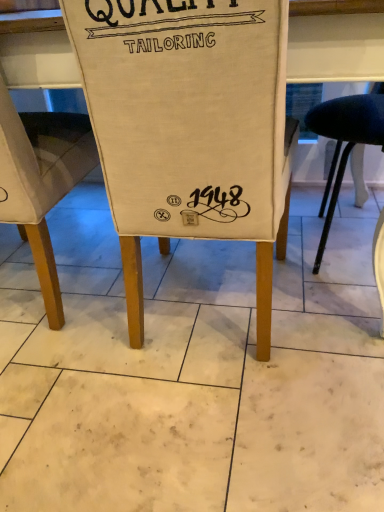
Describe the element at coordinates (190, 128) in the screenshot. I see `canvas bag at center, positioned as the 1th chair in right-to-left order` at that location.

The height and width of the screenshot is (512, 384). What are the coordinates of `canvas bag at center, positioned as the 1th chair in right-to-left order` in the screenshot? It's located at (190, 128).

The width and height of the screenshot is (384, 512). In order to click on canvas chair at lower left, acting as the 1th chair starting from the left in this screenshot , I will do `click(41, 181)`.

Measure the distance between point (29, 190) and camera.

A distance of 1.04 meters exists between point (29, 190) and camera.

The height and width of the screenshot is (512, 384). Describe the element at coordinates (41, 181) in the screenshot. I see `canvas chair at lower left, the 2th chair viewed from the right` at that location.

I want to click on canvas bag at center, positioned as the 1th chair in right-to-left order, so click(190, 128).

Is canvas chair at lower left, the 2th chair viewed from the right, to the left or to the right of canvas bag at center, positioned as the 1th chair in right-to-left order, in the image?

From the image, it's evident that canvas chair at lower left, the 2th chair viewed from the right, is to the left of canvas bag at center, positioned as the 1th chair in right-to-left order.

Looking at this image, is canvas chair at lower left, the 2th chair viewed from the right, further to camera compared to canvas bag at center, which appears as the second chair when viewed from the left?

Yes.

Which is further, (27,123) or (154,106)?

The point (27,123) is behind.

From the image's perspective, is canvas chair at lower left, the 2th chair viewed from the right, located above or below canvas bag at center, which appears as the second chair when viewed from the left?

Based on their image positions, canvas chair at lower left, the 2th chair viewed from the right, is located above canvas bag at center, which appears as the second chair when viewed from the left.

From a real-world perspective, which is physically below, canvas chair at lower left, acting as the 1th chair starting from the left, or canvas bag at center, which appears as the second chair when viewed from the left?

In real-world perspective, canvas chair at lower left, acting as the 1th chair starting from the left, is lower.

In the scene shown: Which of these two, canvas chair at lower left, acting as the 1th chair starting from the left, or canvas bag at center, which appears as the second chair when viewed from the left, is thinner?

canvas chair at lower left, acting as the 1th chair starting from the left, is thinner.

Which of these two, canvas chair at lower left, acting as the 1th chair starting from the left, or canvas bag at center, which appears as the second chair when viewed from the left, stands shorter?

With less height is canvas chair at lower left, acting as the 1th chair starting from the left.

Between canvas chair at lower left, acting as the 1th chair starting from the left, and canvas bag at center, positioned as the 1th chair in right-to-left order, which one has smaller size?

canvas chair at lower left, acting as the 1th chair starting from the left.

Is canvas chair at lower left, the 2th chair viewed from the right, positioned beyond the bounds of canvas bag at center, positioned as the 1th chair in right-to-left order?

Absolutely, canvas chair at lower left, the 2th chair viewed from the right, is external to canvas bag at center, positioned as the 1th chair in right-to-left order.

Are canvas chair at lower left, the 2th chair viewed from the right, and canvas bag at center, positioned as the 1th chair in right-to-left order, located far from each other?

canvas chair at lower left, the 2th chair viewed from the right, is near canvas bag at center, positioned as the 1th chair in right-to-left order, not far away.

Is canvas bag at center, positioned as the 1th chair in right-to-left order, at the back of canvas chair at lower left, acting as the 1th chair starting from the left?

No, canvas chair at lower left, acting as the 1th chair starting from the left,'s orientation is not away from canvas bag at center, positioned as the 1th chair in right-to-left order.

Can you tell me how much canvas chair at lower left, acting as the 1th chair starting from the left, and canvas bag at center, positioned as the 1th chair in right-to-left order, differ in facing direction?

The facing directions of canvas chair at lower left, acting as the 1th chair starting from the left, and canvas bag at center, positioned as the 1th chair in right-to-left order, are 0.000404 degrees apart.

You are a GUI agent. You are given a task and a screenshot of the screen. Output one action in this format:
    pyautogui.click(x=<x>, y=<y>)
    Task: Click on the chair located above the canvas chair at lower left, the 2th chair viewed from the right (from a real-world perspective)
    The image size is (384, 512).
    Given the screenshot: What is the action you would take?
    pyautogui.click(x=190, y=128)

In the image, is canvas bag at center, which appears as the second chair when viewed from the left, on the left side or the right side of canvas chair at lower left, acting as the 1th chair starting from the left?

canvas bag at center, which appears as the second chair when viewed from the left, is positioned on canvas chair at lower left, acting as the 1th chair starting from the left,'s right side.

Is canvas bag at center, positioned as the 1th chair in right-to-left order, further to camera compared to canvas chair at lower left, acting as the 1th chair starting from the left?

No, canvas bag at center, positioned as the 1th chair in right-to-left order, is closer to the viewer.

Is point (279, 79) positioned behind point (4, 176)?

No, (279, 79) is in front of (4, 176).

From the image's perspective, which object appears higher, canvas bag at center, which appears as the second chair when viewed from the left, or canvas chair at lower left, the 2th chair viewed from the right?

canvas chair at lower left, the 2th chair viewed from the right, from the image's perspective.

From a real-world perspective, which object stands above the other?

In real-world perspective, canvas bag at center, positioned as the 1th chair in right-to-left order, is above.

Which object is thinner, canvas bag at center, positioned as the 1th chair in right-to-left order, or canvas chair at lower left, acting as the 1th chair starting from the left?

canvas chair at lower left, acting as the 1th chair starting from the left, is thinner.

Considering the sizes of objects canvas bag at center, positioned as the 1th chair in right-to-left order, and canvas chair at lower left, the 2th chair viewed from the right, in the image provided, who is taller, canvas bag at center, positioned as the 1th chair in right-to-left order, or canvas chair at lower left, the 2th chair viewed from the right,?

With more height is canvas bag at center, positioned as the 1th chair in right-to-left order.

Can you confirm if canvas bag at center, which appears as the second chair when viewed from the left, is smaller than canvas chair at lower left, acting as the 1th chair starting from the left?

No, canvas bag at center, which appears as the second chair when viewed from the left, is not smaller than canvas chair at lower left, acting as the 1th chair starting from the left.

Would you say canvas bag at center, which appears as the second chair when viewed from the left, contains canvas chair at lower left, the 2th chair viewed from the right?

No, canvas chair at lower left, the 2th chair viewed from the right, is located outside of canvas bag at center, which appears as the second chair when viewed from the left.

Can you see canvas bag at center, which appears as the second chair when viewed from the left, touching canvas chair at lower left, the 2th chair viewed from the right?

canvas bag at center, which appears as the second chair when viewed from the left, and canvas chair at lower left, the 2th chair viewed from the right, are not in contact.

Is canvas bag at center, which appears as the second chair when viewed from the left, aimed at canvas chair at lower left, acting as the 1th chair starting from the left?

No, canvas bag at center, which appears as the second chair when viewed from the left, is not aimed at canvas chair at lower left, acting as the 1th chair starting from the left.

How much distance is there between canvas bag at center, which appears as the second chair when viewed from the left, and canvas chair at lower left, acting as the 1th chair starting from the left?

They are 14.96 inches apart.

You are a GUI agent. You are given a task and a screenshot of the screen. Output one action in this format:
    pyautogui.click(x=<x>, y=<y>)
    Task: Click on the chair that is behind the canvas bag at center, positioned as the 1th chair in right-to-left order
    This screenshot has width=384, height=512.
    Given the screenshot: What is the action you would take?
    click(41, 181)

Find the location of a particular element. This screenshot has height=512, width=384. chair on the left of canvas bag at center, positioned as the 1th chair in right-to-left order is located at coordinates (41, 181).

The image size is (384, 512). I want to click on chair below the canvas bag at center, which appears as the second chair when viewed from the left (from a real-world perspective), so click(x=41, y=181).